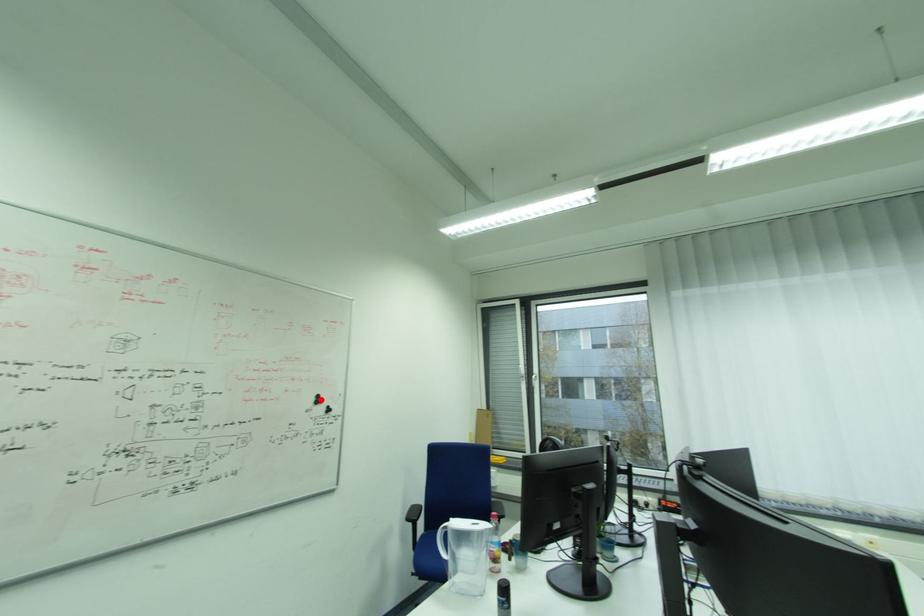
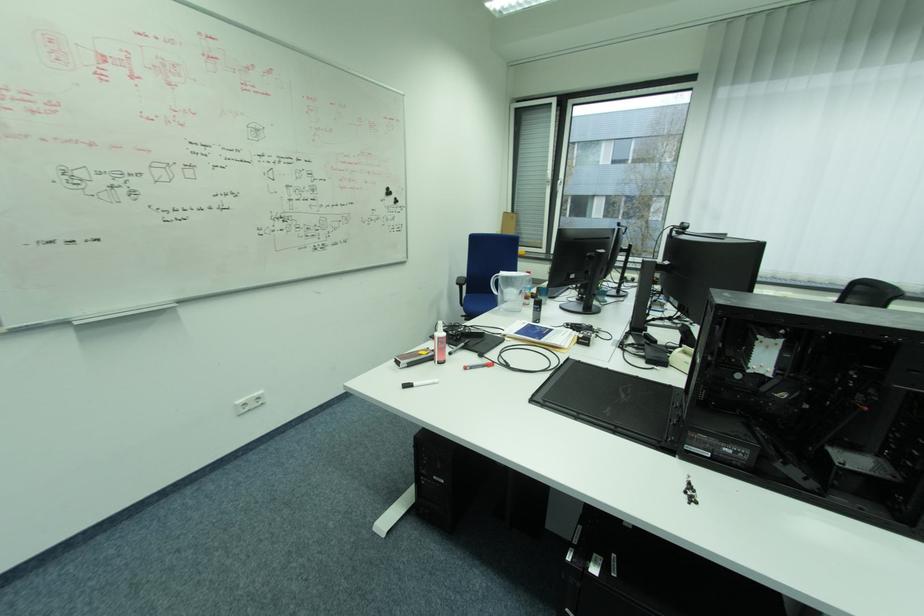
In the second image, find the point that corresponds to the highlighted location in the first image.

(392, 192)